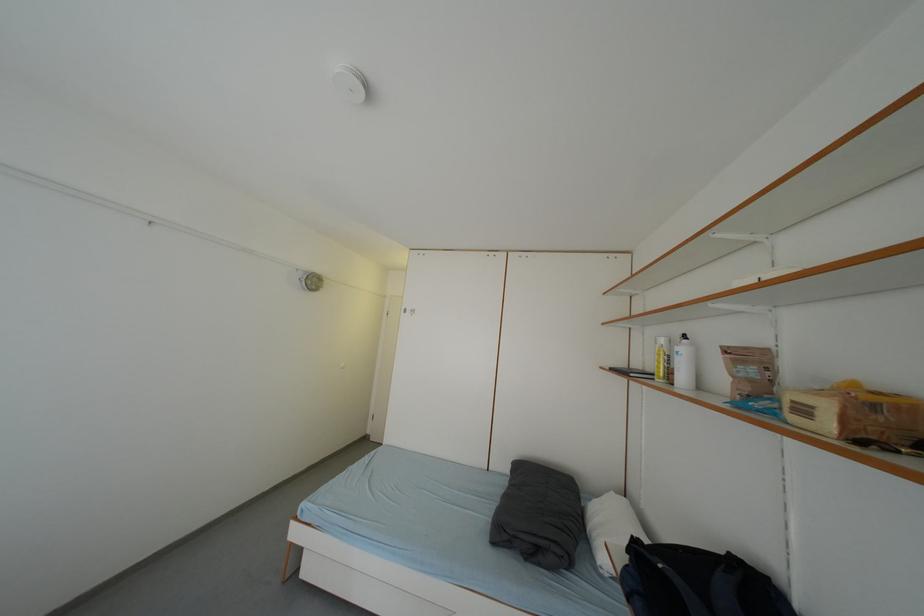
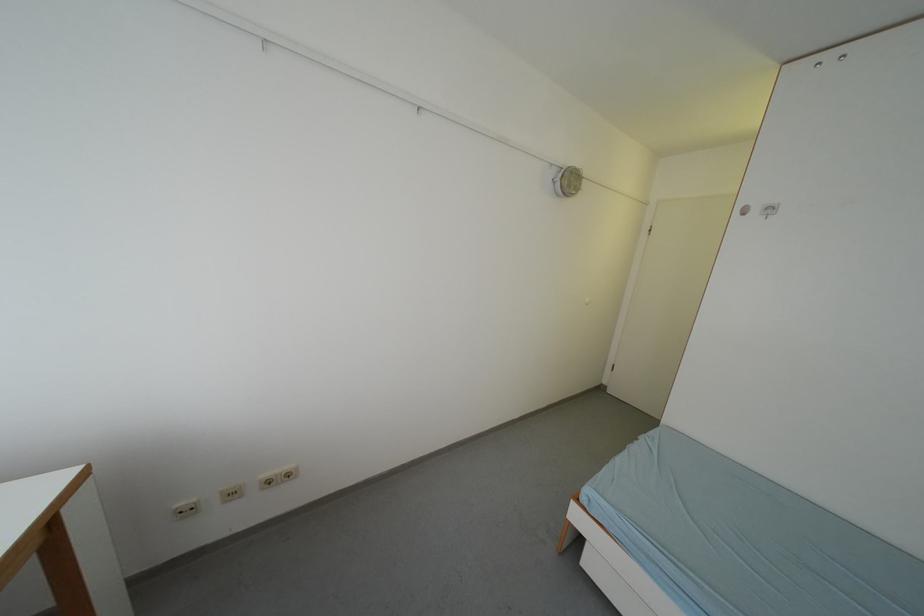
Question: How did the camera likely rotate?

Choices:
 (A) Left
 (B) Right
 (C) Up
 (D) Down

Answer: (A)